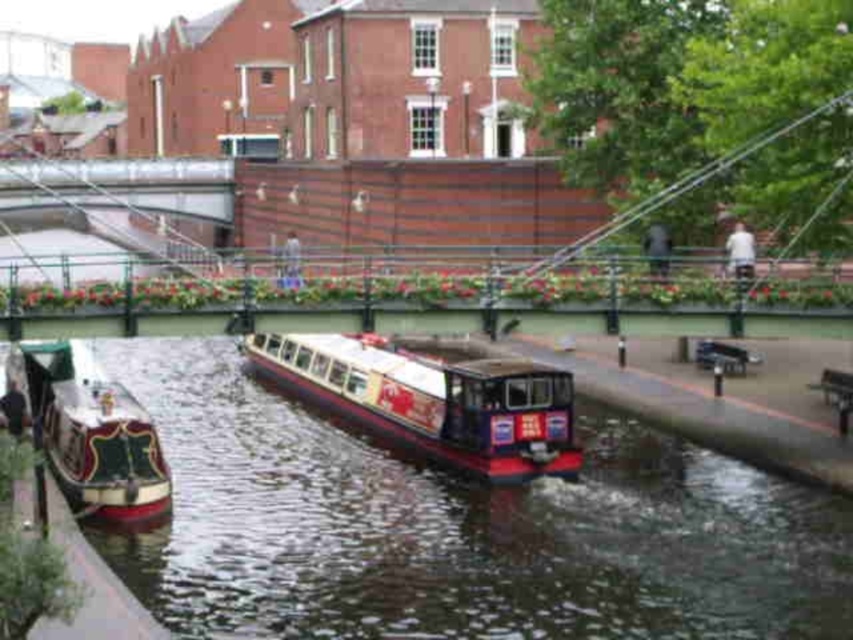
You are a delivery person needing to choose between two narrowboats on the canal to transport a large package. The shiny metallic boat at center and the polished wood boat at lower left are available. Which boat should you choose based on their sizes?

The shiny metallic boat at center has a larger size compared to the polished wood boat at lower left, so you should choose the shiny metallic boat at center to transport the large package.

You are standing on the walkway next to the canal and want to know what is located at the coordinate point [459,529] in the image. What would you find there?

At the coordinate point [459,529], you would find smooth dark water at center.